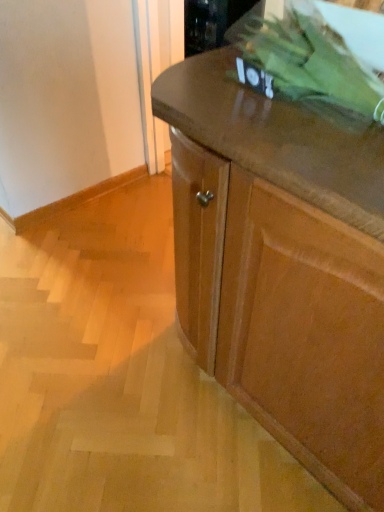
Describe the element at coordinates (284, 317) in the screenshot. I see `wooden cabinet at center` at that location.

Find the location of a particular element. Image resolution: width=384 pixels, height=512 pixels. wooden cabinet at center is located at coordinates click(284, 317).

In order to face wooden cabinet at center, should I rotate leftwards or rightwards?

Rotate your view right by about 16.703°.

Image resolution: width=384 pixels, height=512 pixels. Identify the location of wooden cabinet at center. (284, 317).